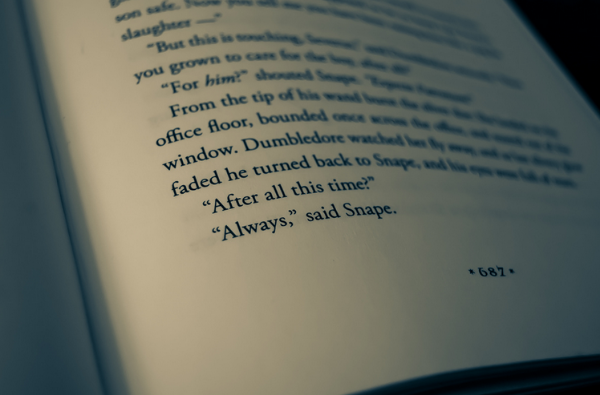
The height and width of the screenshot is (395, 600). Identify the location of word 'floor'. (228, 123).